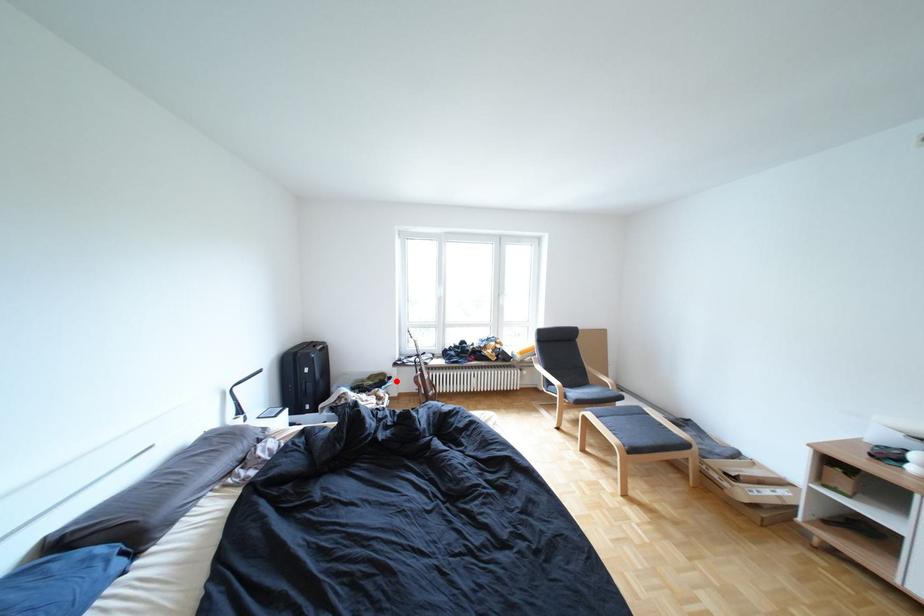
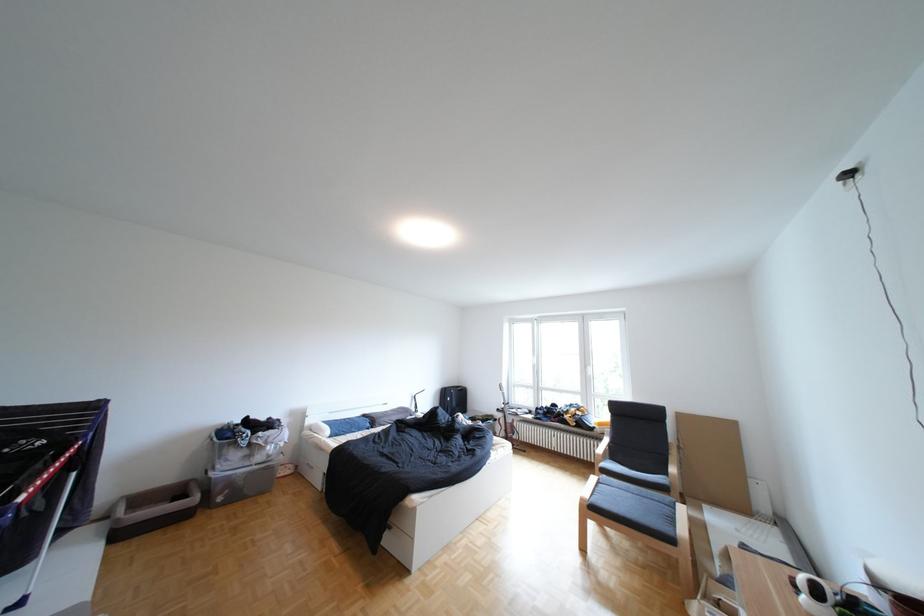
In the second image, find the point that corresponds to the highlighted location in the first image.

(502, 419)